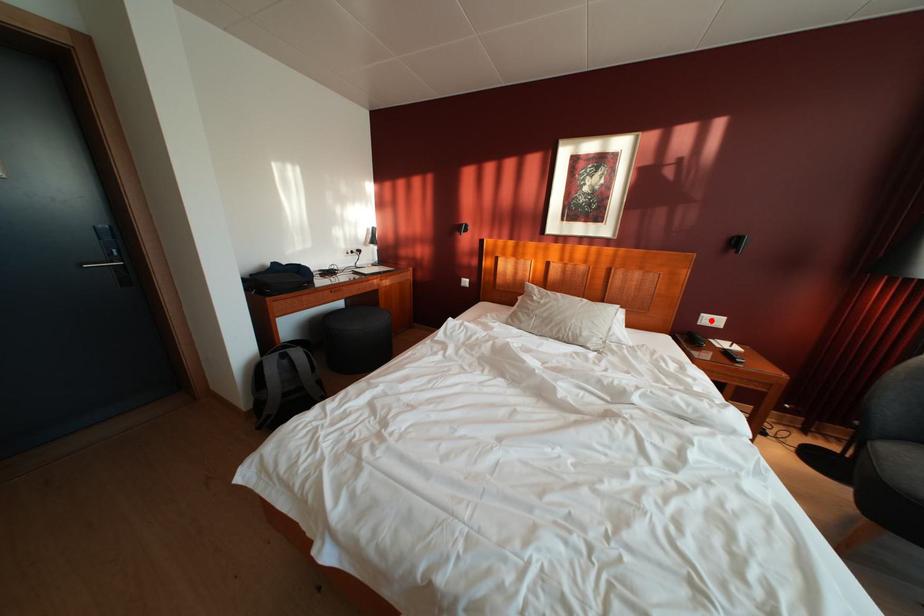
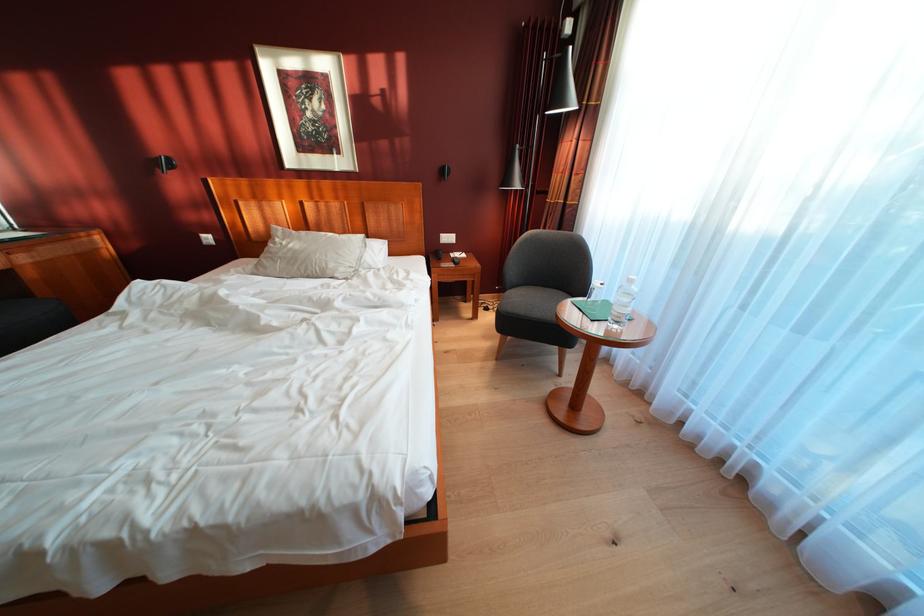
Question: A red point is marked in image1. In image2, is the corresponding 3D point closer to the camera or farther? Reply with the corresponding letter.

Choices:
 (A) The corresponding 3D point is closer.
 (B) The corresponding 3D point is farther.

Answer: (A)